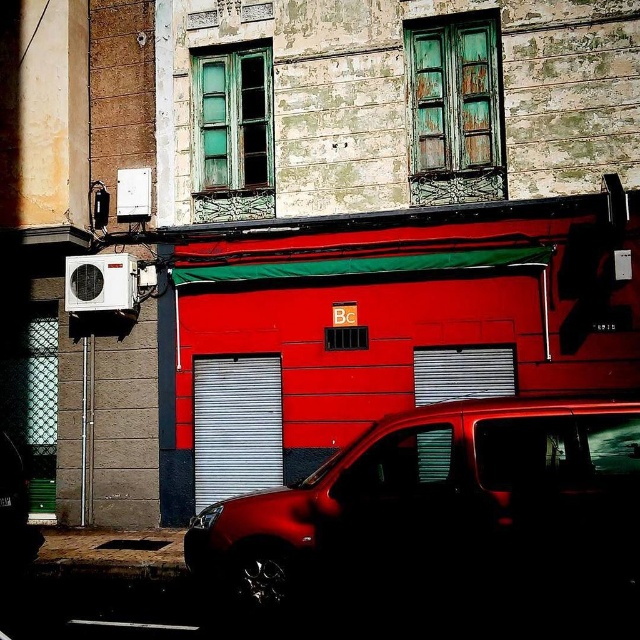
Question: Which point is farther from the camera taking this photo?

Choices:
 (A) (211, 372)
 (B) (324, 488)

Answer: (A)

Question: Is glossy metallic van at center further to the viewer compared to metallic silver garage door at center?

Choices:
 (A) no
 (B) yes

Answer: (A)

Question: Is glossy metallic van at center above metallic silver garage door at center?

Choices:
 (A) yes
 (B) no

Answer: (B)

Question: Which object is closer to the camera taking this photo?

Choices:
 (A) metallic silver garage door at center
 (B) glossy metallic van at center

Answer: (B)

Question: Where is glossy metallic van at center located in relation to metallic silver garage door at center in the image?

Choices:
 (A) left
 (B) right

Answer: (B)

Question: Which object is closer to the camera taking this photo?

Choices:
 (A) metallic silver garage door at center
 (B) glossy metallic van at center

Answer: (B)